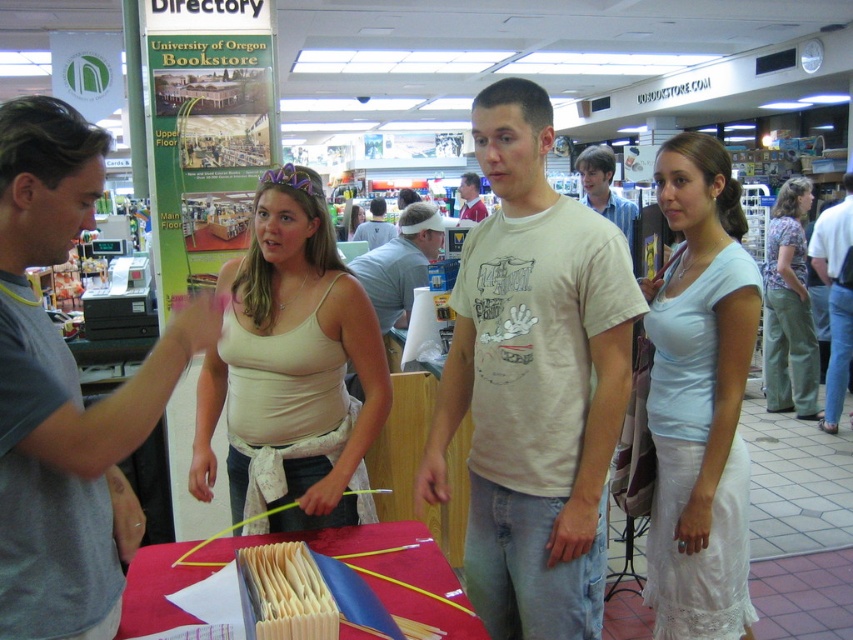
Question: Does light blue cotton dress at center appear on the right side of printed floral blouse at center?

Choices:
 (A) yes
 (B) no

Answer: (B)

Question: Which of the following is the closest to the observer?

Choices:
 (A) printed floral blouse at center
 (B) jeans at center

Answer: (B)

Question: Considering the relative positions of gray cotton t-shirt at left and beige fabric tank top at center in the image provided, where is gray cotton t-shirt at left located with respect to beige fabric tank top at center?

Choices:
 (A) below
 (B) above

Answer: (B)

Question: Considering the real-world distances, which object is closest to the light blue cotton dress at center?

Choices:
 (A) light gray t-shirt at center
 (B) printed floral blouse at center
 (C) light beige cotton t-shirt at center
 (D) blue cotton shirt at center

Answer: (C)

Question: Is gray cotton t-shirt at left bigger than printed floral blouse at center?

Choices:
 (A) no
 (B) yes

Answer: (A)

Question: Considering the real-world distances, which object is closest to the light gray cotton shirt at center?

Choices:
 (A) gray cotton t-shirt at left
 (B) light blue cotton dress at center
 (C) light beige cotton t-shirt at center
 (D) blue cotton shirt at center

Answer: (D)